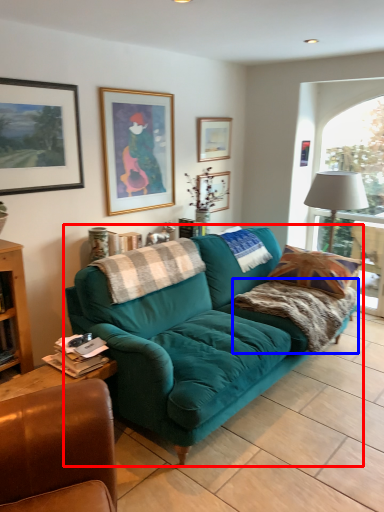
Question: Among these objects, which one is farthest to the camera, studio couch (highlighted by a red box) or blanket (highlighted by a blue box)?

Choices:
 (A) studio couch
 (B) blanket

Answer: (B)